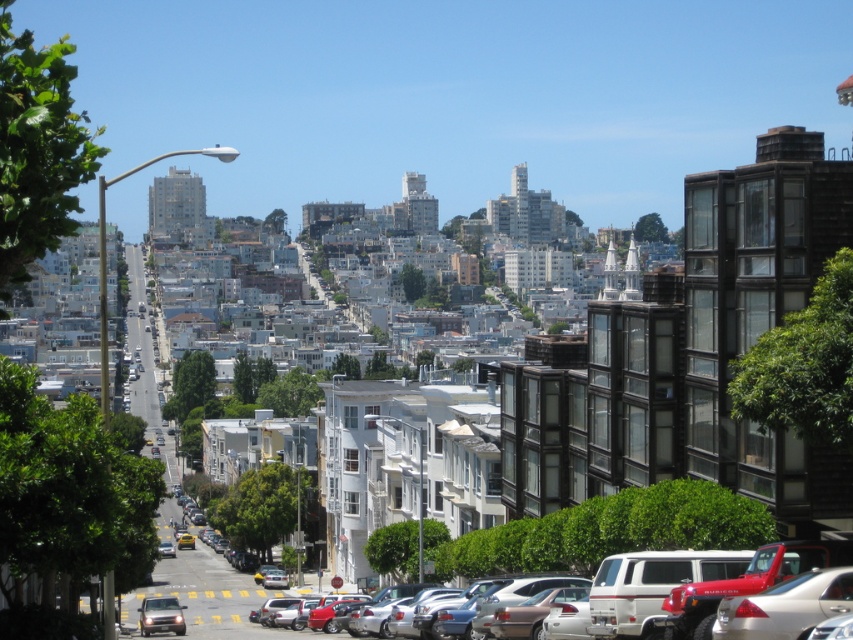
You are a delivery driver needing to park your van between the metallic silver sedan at lower center and the shiny silver suv at lower left. Can your van, which is 2.5 meters wide, fit in the space between them?

The metallic silver sedan at lower center is wider than the shiny silver suv at lower left. However, the exact width of the space between them isn

You are a delivery drone that needs to fly between the metallic silver sedan at lower center and the shiny silver suv at lower left. Given that your drone has a minimum required clearance of 1.2 meters to safely pass through, can you determine if there is enough vertical space between them?

The metallic silver sedan at lower center is taller than the shiny silver suv at lower left. However, the exact height difference isn